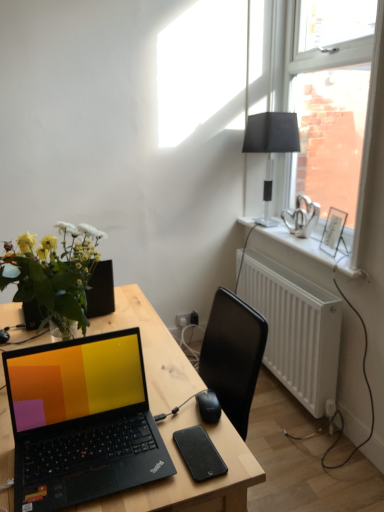
What is the approximate width of black matte lampshade at upper right?

black matte lampshade at upper right is 23.60 centimeters wide.

Locate an element on the screen. This screenshot has height=512, width=384. black wood desk at center is located at coordinates (111, 423).

At what (x,y) coordinates should I click in order to perform the action: click on white plastic radiator at lower right. Please return your answer as a coordinate pair (x, y). The width and height of the screenshot is (384, 512). Looking at the image, I should click on (295, 329).

Relative to black matte tablet at center, is white plastic radiator at lower right in front or behind?

white plastic radiator at lower right is behind black matte tablet at center.

Considering the relative sizes of white plastic radiator at lower right and black matte tablet at center in the image provided, is white plastic radiator at lower right shorter than black matte tablet at center?

No.

Based on the photo, from the image's perspective, is white plastic radiator at lower right below black matte tablet at center?

Incorrect, from the image's perspective, white plastic radiator at lower right is higher than black matte tablet at center.

Is point (279, 365) closer to viewer compared to point (213, 465)?

No, (279, 365) is further to viewer.

Between black matte tablet at center and white plastic radiator at lower right, which one has less height?

With less height is black matte tablet at center.

Looking at this image, considering the relative sizes of black matte tablet at center and white plastic radiator at lower right in the image provided, is black matte tablet at center bigger than white plastic radiator at lower right?

No, black matte tablet at center is not bigger than white plastic radiator at lower right.

Can white plastic radiator at lower right be found inside black matte tablet at center?

No, white plastic radiator at lower right is located outside of black matte tablet at center.

Between black matte tablet at center and white plastic radiator at lower right, which one has larger width?

Wider between the two is black matte tablet at center.

Does black matte tablet at center have a smaller size compared to black wood desk at center?

Correct, black matte tablet at center occupies less space than black wood desk at center.

Is black matte tablet at center facing towards black wood desk at center?

Yes, black matte tablet at center faces towards black wood desk at center.

Which is behind, black matte tablet at center or black wood desk at center?

black matte tablet at center is behind.

Based on the photo, would you say white painted wood at upper right is a long distance from white plastic radiator at lower right?

Actually, white painted wood at upper right and white plastic radiator at lower right are a little close together.

Consider the image. From the image's perspective, between white painted wood at upper right and white plastic radiator at lower right, which one is located above?

white painted wood at upper right is shown above in the image.

Between white painted wood at upper right and white plastic radiator at lower right, which one is positioned in front?

white painted wood at upper right is more forward.

Would you say white painted wood at upper right is outside black wood desk at center?

Yes.

Can you confirm if white painted wood at upper right is wider than black wood desk at center?

In fact, white painted wood at upper right might be narrower than black wood desk at center.

Does white painted wood at upper right come behind black wood desk at center?

Yes, it is.

Is point (278, 229) farther from viewer compared to point (0, 475)?

Yes, it is behind point (0, 475).

At what (x,y) coordinates should I click in order to perform the action: click on radiator on the right of the black plastic mouse at center. Please return your answer as a coordinate pair (x, y). The width and height of the screenshot is (384, 512). Looking at the image, I should click on (295, 329).

Does point (207, 390) appear closer or farther from the camera than point (327, 359)?

Point (207, 390) appears to be closer to the viewer than point (327, 359).

From the picture: Is black plastic mouse at center with white plastic radiator at lower right?

No, black plastic mouse at center is not making contact with white plastic radiator at lower right.

Is black matte lampshade at upper right aimed at black plastic mouse at center?

No, black matte lampshade at upper right is not aimed at black plastic mouse at center.

Which is closer to the camera, (260,130) or (212,413)?

Clearly, point (260,130) is more distant from the camera than point (212,413).

Can you tell me how much black matte lampshade at upper right and black plastic mouse at center differ in facing direction?

They differ by 83.3 degrees in their facing directions.

You are a GUI agent. You are given a task and a screenshot of the screen. Output one action in this format:
    pyautogui.click(x=<x>, y=<y>)
    Task: Click on the computer mouse below the black matte lampshade at upper right (from the image's perspective)
    The height and width of the screenshot is (512, 384).
    Given the screenshot: What is the action you would take?
    pyautogui.click(x=208, y=406)

At what (x,y) coordinates should I click in order to perform the action: click on tablet computer that is on the left side of white plastic radiator at lower right. Please return your answer as a coordinate pair (x, y). The image size is (384, 512). Looking at the image, I should click on tap(199, 453).

Find the location of `radiator above the black matte tablet at center (from the image's perspective)`. radiator above the black matte tablet at center (from the image's perspective) is located at coordinates (295, 329).

From the image, which object appears to be farther from white plastic radiator at lower right, black matte lampshade at upper right or black wood desk at center?

Among the two, black wood desk at center is located further to white plastic radiator at lower right.

Which object lies further to the anchor point white painted wood at upper right, white plastic radiator at lower right or black wood desk at center?

black wood desk at center is positioned further to the anchor white painted wood at upper right.

From the image, which object appears to be farther from white plastic radiator at lower right, black matte tablet at center or black wood desk at center?

Based on the image, black matte tablet at center appears to be further to white plastic radiator at lower right.

Considering their positions, is black plastic mouse at center positioned further to white painted wood at upper right than black wood desk at center?

black plastic mouse at center lies further to white painted wood at upper right than the other object.

Considering their positions, is black plastic mouse at center positioned closer to black wood desk at center than black matte lampshade at upper right?

black plastic mouse at center is closer to black wood desk at center.

Estimate the real-world distances between objects in this image. Which object is further from white painted wood at upper right, black matte tablet at center or white plastic radiator at lower right?

The object further to white painted wood at upper right is black matte tablet at center.

Looking at the image, which one is located further to black matte lampshade at upper right, black plastic mouse at center or white plastic radiator at lower right?

black plastic mouse at center is positioned further to the anchor black matte lampshade at upper right.

Based on their spatial positions, is black matte lampshade at upper right or black plastic mouse at center closer to black wood desk at center?

black plastic mouse at center is closer to black wood desk at center.

Locate an element on the screen. window sill between black plastic mouse at center and white plastic radiator at lower right along the z-axis is located at coordinates (300, 244).

Locate an element on the screen. The height and width of the screenshot is (512, 384). window sill between black wood desk at center and white plastic radiator at lower right along the z-axis is located at coordinates (300, 244).

Identify the location of window sill between black matte tablet at center and white plastic radiator at lower right in the front-back direction. (300, 244).

You are a GUI agent. You are given a task and a screenshot of the screen. Output one action in this format:
    pyautogui.click(x=<x>, y=<y>)
    Task: Click on the tablet computer between black wood desk at center and black plastic mouse at center
    Image resolution: width=384 pixels, height=512 pixels.
    Given the screenshot: What is the action you would take?
    pyautogui.click(x=199, y=453)